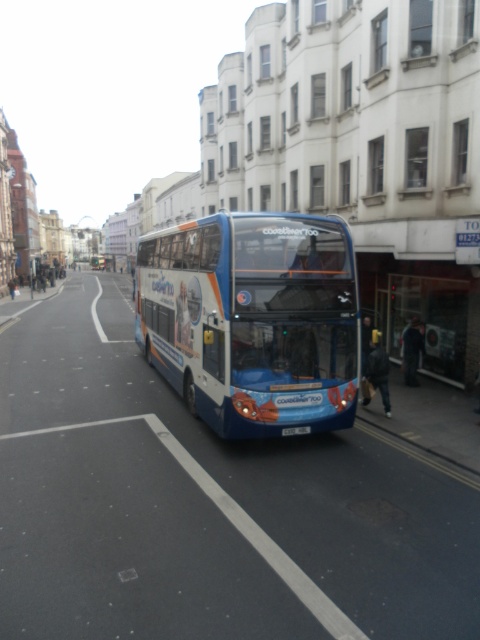
In the scene shown: Does blue matte/decorative bus at center have a larger size compared to blue plastic license plate at center?

Yes.

Between point (191, 225) and point (304, 428), which one is positioned behind?

The point (191, 225) is behind.

The height and width of the screenshot is (640, 480). Identify the location of blue matte/decorative bus at center. (252, 321).

Identify the location of blue matte/decorative bus at center. (252, 321).